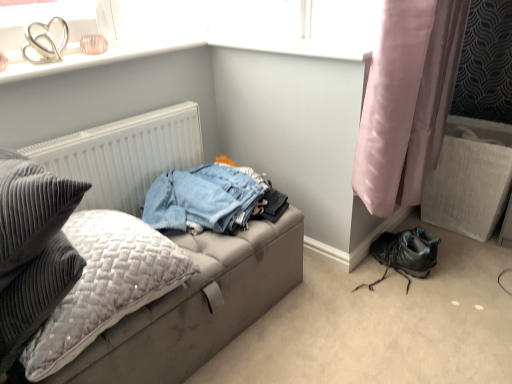
Question: Considering the relative positions of leatherette studio couch at left and white textured radiator at upper left in the image provided, is leatherette studio couch at left behind white textured radiator at upper left?

Choices:
 (A) no
 (B) yes

Answer: (A)

Question: Would you say leatherette studio couch at left contains white textured radiator at upper left?

Choices:
 (A) yes
 (B) no

Answer: (B)

Question: Is leatherette studio couch at left oriented towards white textured radiator at upper left?

Choices:
 (A) no
 (B) yes

Answer: (A)

Question: Can you confirm if leatherette studio couch at left is bigger than white textured radiator at upper left?

Choices:
 (A) no
 (B) yes

Answer: (B)

Question: Does leatherette studio couch at left have a lesser width compared to white textured radiator at upper left?

Choices:
 (A) yes
 (B) no

Answer: (B)

Question: Is leatherette studio couch at left placed right next to white textured radiator at upper left?

Choices:
 (A) yes
 (B) no

Answer: (B)

Question: Can you confirm if clear glass heart at upper left is taller than pink satin curtain at lower right?

Choices:
 (A) yes
 (B) no

Answer: (B)

Question: Could you tell me if clear glass heart at upper left is facing pink satin curtain at lower right?

Choices:
 (A) yes
 (B) no

Answer: (B)

Question: Does clear glass heart at upper left have a lesser height compared to pink satin curtain at lower right?

Choices:
 (A) no
 (B) yes

Answer: (B)

Question: Considering the relative sizes of clear glass heart at upper left and pink satin curtain at lower right in the image provided, is clear glass heart at upper left wider than pink satin curtain at lower right?

Choices:
 (A) no
 (B) yes

Answer: (A)

Question: Does clear glass heart at upper left appear on the right side of pink satin curtain at lower right?

Choices:
 (A) no
 (B) yes

Answer: (A)

Question: From a real-world perspective, is clear glass heart at upper left physically below pink satin curtain at lower right?

Choices:
 (A) no
 (B) yes

Answer: (A)

Question: Could pink satin curtain at lower right be considered to be inside white textured radiator at upper left?

Choices:
 (A) yes
 (B) no

Answer: (B)